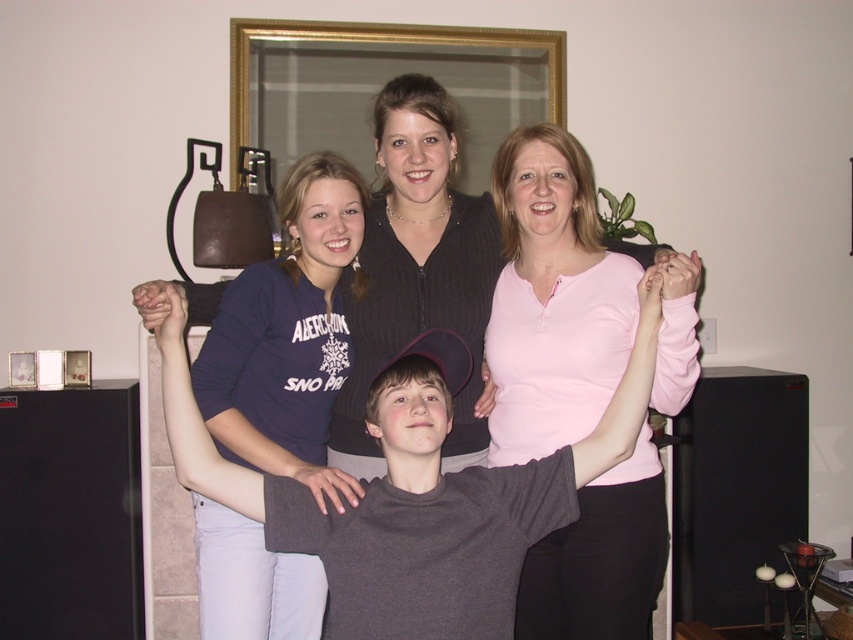
Question: Observing the image, what is the correct spatial positioning of dark gray cotton shirt at center in reference to dark blue jersey at center?

Choices:
 (A) right
 (B) left

Answer: (A)

Question: Among these objects, which one is farthest from the camera?

Choices:
 (A) pink soft fabric shirt at upper center
 (B) dark gray cotton shirt at center
 (C) dark blue jersey at center

Answer: (A)

Question: Where is pink soft fabric shirt at upper center located in relation to dark gray cotton shirt at center in the image?

Choices:
 (A) right
 (B) left

Answer: (A)

Question: Which object is closer to the camera taking this photo?

Choices:
 (A) pink soft fabric shirt at upper center
 (B) dark gray cotton shirt at center
 (C) dark blue jersey at center

Answer: (B)

Question: Which object appears closest to the camera in this image?

Choices:
 (A) dark gray cotton shirt at center
 (B) dark blue jersey at center

Answer: (A)

Question: Does pink soft fabric shirt at upper center appear under dark blue jersey at center?

Choices:
 (A) no
 (B) yes

Answer: (A)